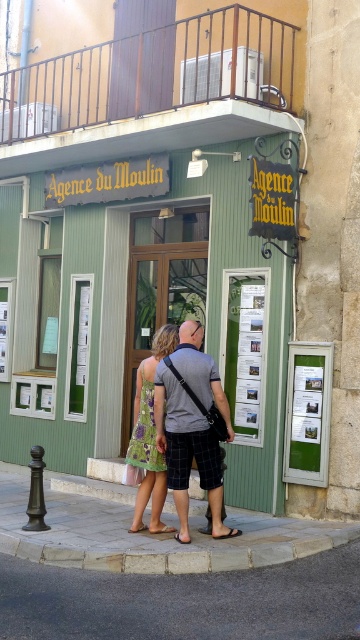
You are standing in front of the building with the green facade and stone wall. You need to locate the green matte signboard at center. According to the coordinates provided, where exactly would you look to find it?

The green matte signboard at center is located at the coordinates point (149,227).

You are standing at the entrance of Agence du Moulin and want to locate two specific points marked on the building facade. The first point is at coordinates point (x=84, y=86) and the second is at point (x=303, y=529). From your current position, which point would be closer to you?

Point (x=303, y=529) is closer to you because it is in front of point (x=84, y=86).